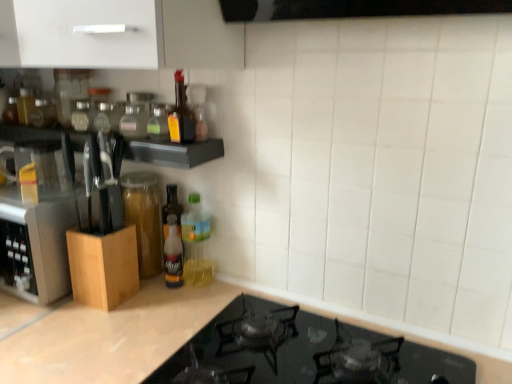
You are a GUI agent. You are given a task and a screenshot of the screen. Output one action in this format:
    pyautogui.click(x=<x>, y=<y>)
    Task: Click on the matte glass bottle at upper center, the second bottle viewed from the top
    The image size is (512, 384).
    Given the screenshot: What is the action you would take?
    pyautogui.click(x=181, y=114)

In order to face transparent glass jar at left, should I rotate leftwards or rightwards?

It's best to rotate left around 15.368 degrees.

What is the approximate height of translucent glass bottle at center, which is the sixth bottle in top-to-bottom order?

translucent glass bottle at center, which is the sixth bottle in top-to-bottom order, is 20.01 centimeters tall.

Where is `translucent glass bottle at upper center, marked as the 4th bottle in a top-to-bottom arrangement`? The image size is (512, 384). translucent glass bottle at upper center, marked as the 4th bottle in a top-to-bottom arrangement is located at coordinates (159, 122).

Measure the distance between translucent plastic bottle at upper center, the third bottle when ordered from top to bottom, and camera.

3.51 feet.

Describe the element at coordinates (136, 115) in the screenshot. The width and height of the screenshot is (512, 384). I see `clear glass bottle at upper center, which is the 6th bottle from bottom to top` at that location.

Where is `matte glass bottle at upper center, the second bottle viewed from the top`? Image resolution: width=512 pixels, height=384 pixels. matte glass bottle at upper center, the second bottle viewed from the top is located at coordinates (181, 114).

From a real-world perspective, which is physically above, matte glass bottle at upper center, the 5th bottle ordered from the bottom, or translucent plastic bottle at center, the second bottle in the bottom-to-top sequence?

matte glass bottle at upper center, the 5th bottle ordered from the bottom, is physically above.

How many degrees apart are the facing directions of matte glass bottle at upper center, the 5th bottle ordered from the bottom, and translucent plastic bottle at center, the second bottle in the bottom-to-top sequence?

They differ by 0.886 degrees in their facing directions.

Considering the relative positions of matte glass bottle at upper center, the 5th bottle ordered from the bottom, and translucent plastic bottle at center, marked as the 5th bottle in a top-to-bottom arrangement, in the image provided, is matte glass bottle at upper center, the 5th bottle ordered from the bottom, to the right of translucent plastic bottle at center, marked as the 5th bottle in a top-to-bottom arrangement, from the viewer's perspective?

No, matte glass bottle at upper center, the 5th bottle ordered from the bottom, is not to the right of translucent plastic bottle at center, marked as the 5th bottle in a top-to-bottom arrangement.

Is matte glass bottle at upper center, the second bottle viewed from the top, situated inside translucent plastic bottle at center, marked as the 5th bottle in a top-to-bottom arrangement, or outside?

matte glass bottle at upper center, the second bottle viewed from the top, is not inside translucent plastic bottle at center, marked as the 5th bottle in a top-to-bottom arrangement, it's outside.

How much distance is there between black glass stovetop at lower center and clear glass bottle at upper center, the first bottle from the top?

The distance of black glass stovetop at lower center from clear glass bottle at upper center, the first bottle from the top, is 20.74 inches.

Who is bigger, black glass stovetop at lower center or clear glass bottle at upper center, the first bottle from the top?

black glass stovetop at lower center.

Considering the positions of objects black glass stovetop at lower center and clear glass bottle at upper center, the first bottle from the top, in the image provided, who is behind, black glass stovetop at lower center or clear glass bottle at upper center, the first bottle from the top,?

clear glass bottle at upper center, the first bottle from the top, is further away from the camera.

Is point (36, 332) closer to viewer compared to point (133, 110)?

Yes, it is in front of point (133, 110).

Is translucent plastic bottle at center, the second bottle in the bottom-to-top sequence, taller or shorter than matte glass bottle at upper center, the 5th bottle ordered from the bottom?

In the image, translucent plastic bottle at center, the second bottle in the bottom-to-top sequence, appears to be taller than matte glass bottle at upper center, the 5th bottle ordered from the bottom.

Which of these two, translucent plastic bottle at center, the second bottle in the bottom-to-top sequence, or matte glass bottle at upper center, the 5th bottle ordered from the bottom, is thinner?

matte glass bottle at upper center, the 5th bottle ordered from the bottom.

Would you say matte glass bottle at upper center, the 5th bottle ordered from the bottom, is part of translucent plastic bottle at center, marked as the 5th bottle in a top-to-bottom arrangement,'s contents?

No, matte glass bottle at upper center, the 5th bottle ordered from the bottom, is not inside translucent plastic bottle at center, marked as the 5th bottle in a top-to-bottom arrangement.

From a real-world perspective, is translucent plastic bottle at center, the second bottle in the bottom-to-top sequence, physically located above or below matte glass bottle at upper center, the second bottle viewed from the top?

translucent plastic bottle at center, the second bottle in the bottom-to-top sequence, is below matte glass bottle at upper center, the second bottle viewed from the top.

Which is closer, (71, 357) or (162, 125)?

The point (71, 357) is in front.

Consider the image. From the image's perspective, between black glass stovetop at lower center and translucent glass bottle at upper center, marked as the 4th bottle in a top-to-bottom arrangement, who is located below?

black glass stovetop at lower center is shown below in the image.

Is black glass stovetop at lower center positioned beyond the bounds of translucent glass bottle at upper center, the third bottle positioned from the bottom?

That's correct, black glass stovetop at lower center is outside of translucent glass bottle at upper center, the third bottle positioned from the bottom.

Does black glass stovetop at lower center have a greater width compared to translucent glass bottle at upper center, marked as the 4th bottle in a top-to-bottom arrangement?

Yes, black glass stovetop at lower center is wider than translucent glass bottle at upper center, marked as the 4th bottle in a top-to-bottom arrangement.

Is translucent plastic bottle at center, marked as the 5th bottle in a top-to-bottom arrangement, not close to translucent glass bottle at center, which is the sixth bottle in top-to-bottom order?

No, translucent plastic bottle at center, marked as the 5th bottle in a top-to-bottom arrangement, is not far away from translucent glass bottle at center, which is the sixth bottle in top-to-bottom order.

How many degrees apart are the facing directions of translucent plastic bottle at center, marked as the 5th bottle in a top-to-bottom arrangement, and translucent glass bottle at center, which is the sixth bottle in top-to-bottom order?

They differ by 0.000222 degrees in their facing directions.

Is translucent plastic bottle at center, marked as the 5th bottle in a top-to-bottom arrangement, positioned with its back to translucent glass bottle at center, which is the sixth bottle in top-to-bottom order?

No, translucent plastic bottle at center, marked as the 5th bottle in a top-to-bottom arrangement, is not facing away from translucent glass bottle at center, which is the sixth bottle in top-to-bottom order.

Locate an element on the screen. the 1st bottle located above the translucent glass bottle at center, the first bottle positioned from the bottom (from a real-world perspective) is located at coordinates (196, 243).

From the image's perspective, which one is positioned higher, translucent glass bottle at center, the first bottle positioned from the bottom, or clear glass bottle at upper center, which is the 6th bottle from bottom to top?

clear glass bottle at upper center, which is the 6th bottle from bottom to top.

From a real-world perspective, is translucent glass bottle at center, the first bottle positioned from the bottom, over clear glass bottle at upper center, the first bottle from the top?

No, from a real-world perspective, translucent glass bottle at center, the first bottle positioned from the bottom, is not on top of clear glass bottle at upper center, the first bottle from the top.

Is translucent glass bottle at center, which is the sixth bottle in top-to-bottom order, outside of clear glass bottle at upper center, which is the 6th bottle from bottom to top?

Yes, translucent glass bottle at center, which is the sixth bottle in top-to-bottom order, is located beyond the bounds of clear glass bottle at upper center, which is the 6th bottle from bottom to top.

At what (x,y) coordinates should I click in order to perform the action: click on bottle that is the 5th one when counting downward from the clear glass bottle at upper center, the first bottle from the top (from the image's perspective). Please return your answer as a coordinate pair (x, y). This screenshot has width=512, height=384. Looking at the image, I should click on (173, 254).

Between matte glass bottle at upper center, the second bottle viewed from the top, and black glass stovetop at lower center, which one has less height?

black glass stovetop at lower center.

Measure the distance between matte glass bottle at upper center, the 5th bottle ordered from the bottom, and black glass stovetop at lower center.

20.35 inches.

From a real-world perspective, count 4th bottles downward from the matte glass bottle at upper center, the second bottle viewed from the top, and point to it. Please provide its 2D coordinates.

[(196, 243)]

Locate an element on the screen. This screenshot has width=512, height=384. countertop in front of the clear glass bottle at upper center, the first bottle from the top is located at coordinates (106, 334).

Based on their spatial positions, is translucent plastic bottle at center, the second bottle in the bottom-to-top sequence, or translucent plastic bottle at upper center, the 4th bottle ordered from the bottom, further from matte glass bottle at upper center, the second bottle viewed from the top?

translucent plastic bottle at center, the second bottle in the bottom-to-top sequence.

Estimate the real-world distances between objects in this image. Which object is further from transparent glass jar at left, translucent plastic bottle at upper center, the third bottle when ordered from top to bottom, or black glass stovetop at lower center?

translucent plastic bottle at upper center, the third bottle when ordered from top to bottom, is further to transparent glass jar at left.

When comparing their distances from translucent plastic bottle at upper center, the third bottle when ordered from top to bottom, does matte glass bottle at upper center, the second bottle viewed from the top, or translucent glass bottle at upper center, the third bottle positioned from the bottom, seem closer?

matte glass bottle at upper center, the second bottle viewed from the top, lies closer to translucent plastic bottle at upper center, the third bottle when ordered from top to bottom, than the other object.

From the picture: Which object lies nearer to the anchor point matte glass bottle at upper center, the 5th bottle ordered from the bottom, clear glass bottle at upper center, the first bottle from the top, or translucent glass bottle at upper center, the third bottle positioned from the bottom?

Among the two, translucent glass bottle at upper center, the third bottle positioned from the bottom, is located nearer to matte glass bottle at upper center, the 5th bottle ordered from the bottom.

Which object lies nearer to the anchor point translucent glass bottle at center, which is the sixth bottle in top-to-bottom order, matte glass bottle at upper center, the 5th bottle ordered from the bottom, or black glass stovetop at lower center?

black glass stovetop at lower center is closer to translucent glass bottle at center, which is the sixth bottle in top-to-bottom order.

Based on their spatial positions, is translucent glass bottle at center, the first bottle positioned from the bottom, or matte glass bottle at upper center, the 5th bottle ordered from the bottom, further from translucent glass bottle at upper center, marked as the 4th bottle in a top-to-bottom arrangement?

The object further to translucent glass bottle at upper center, marked as the 4th bottle in a top-to-bottom arrangement, is translucent glass bottle at center, the first bottle positioned from the bottom.

Looking at the image, which one is located closer to black glass stovetop at lower center, translucent glass bottle at upper center, marked as the 4th bottle in a top-to-bottom arrangement, or clear glass bottle at upper center, the first bottle from the top?

translucent glass bottle at upper center, marked as the 4th bottle in a top-to-bottom arrangement, is positioned closer to the anchor black glass stovetop at lower center.

Estimate the real-world distances between objects in this image. Which object is closer to black glass stovetop at lower center, matte glass bottle at upper center, the 5th bottle ordered from the bottom, or clear glass bottle at upper center, the first bottle from the top?

matte glass bottle at upper center, the 5th bottle ordered from the bottom, is closer to black glass stovetop at lower center.

Where is `glass jar between translucent glass bottle at upper center, marked as the 4th bottle in a top-to-bottom arrangement, and translucent glass bottle at center, the first bottle positioned from the bottom, vertically`? This screenshot has height=384, width=512. glass jar between translucent glass bottle at upper center, marked as the 4th bottle in a top-to-bottom arrangement, and translucent glass bottle at center, the first bottle positioned from the bottom, vertically is located at coordinates (144, 219).

The height and width of the screenshot is (384, 512). I want to click on glass jar that lies between translucent plastic bottle at upper center, the 4th bottle ordered from the bottom, and translucent plastic bottle at center, marked as the 5th bottle in a top-to-bottom arrangement, from top to bottom, so click(x=144, y=219).

Find the location of a particular element. bottle between translucent glass bottle at upper center, the third bottle positioned from the bottom, and translucent glass bottle at center, the first bottle positioned from the bottom, vertically is located at coordinates (196, 243).

Locate an element on the screen. The height and width of the screenshot is (384, 512). glass jar between clear glass bottle at upper center, which is the 6th bottle from bottom to top, and translucent plastic bottle at center, the second bottle in the bottom-to-top sequence, in the vertical direction is located at coordinates (144, 219).